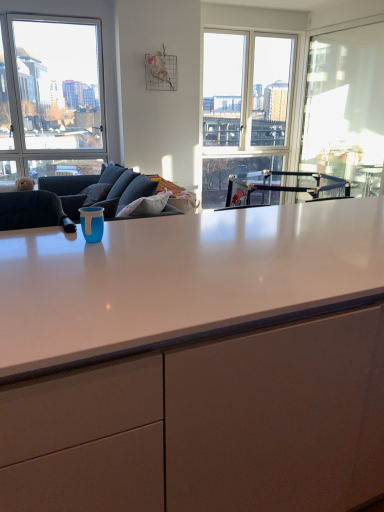
Question: From a real-world perspective, is clear glass window at upper left over transparent glass window screen at right?

Choices:
 (A) no
 (B) yes

Answer: (B)

Question: Would you say clear glass window at upper left is a long distance from transparent glass window screen at right?

Choices:
 (A) yes
 (B) no

Answer: (A)

Question: Does clear glass window at upper left lie behind transparent glass window screen at right?

Choices:
 (A) yes
 (B) no

Answer: (A)

Question: Does clear glass window at upper left appear on the left side of transparent glass window screen at right?

Choices:
 (A) yes
 (B) no

Answer: (A)

Question: Is clear glass window at upper left to the right of transparent glass window screen at right from the viewer's perspective?

Choices:
 (A) no
 (B) yes

Answer: (A)

Question: In terms of height, does clear glass window at upper left look taller or shorter compared to transparent glass window screen at right?

Choices:
 (A) tall
 (B) short

Answer: (A)

Question: Is point (52, 109) positioned closer to the camera than point (379, 55)?

Choices:
 (A) closer
 (B) farther

Answer: (B)

Question: From the image's perspective, is clear glass window at upper left located above or below transparent glass window screen at right?

Choices:
 (A) above
 (B) below

Answer: (A)

Question: From a real-world perspective, is clear glass window at upper left physically located above or below transparent glass window screen at right?

Choices:
 (A) below
 (B) above

Answer: (B)

Question: In terms of size, does white glossy cabinet at center appear bigger or smaller than transparent glass window screen at right?

Choices:
 (A) big
 (B) small

Answer: (A)

Question: Is white glossy cabinet at center to the left or to the right of transparent glass window screen at right in the image?

Choices:
 (A) right
 (B) left

Answer: (B)

Question: From their relative heights in the image, would you say white glossy cabinet at center is taller or shorter than transparent glass window screen at right?

Choices:
 (A) short
 (B) tall

Answer: (A)

Question: From the image's perspective, is white glossy cabinet at center located above or below transparent glass window screen at right?

Choices:
 (A) above
 (B) below

Answer: (B)

Question: Relative to white glossy cabinet at center, is transparent glass window screen at right in front or behind?

Choices:
 (A) behind
 (B) front

Answer: (A)

Question: From their relative heights in the image, would you say transparent glass window screen at right is taller or shorter than white glossy cabinet at center?

Choices:
 (A) short
 (B) tall

Answer: (B)